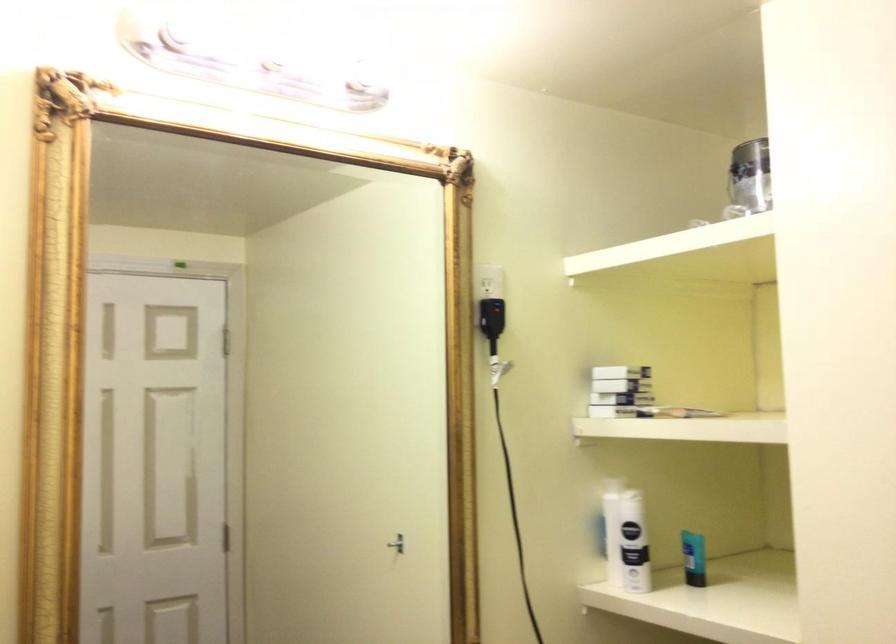
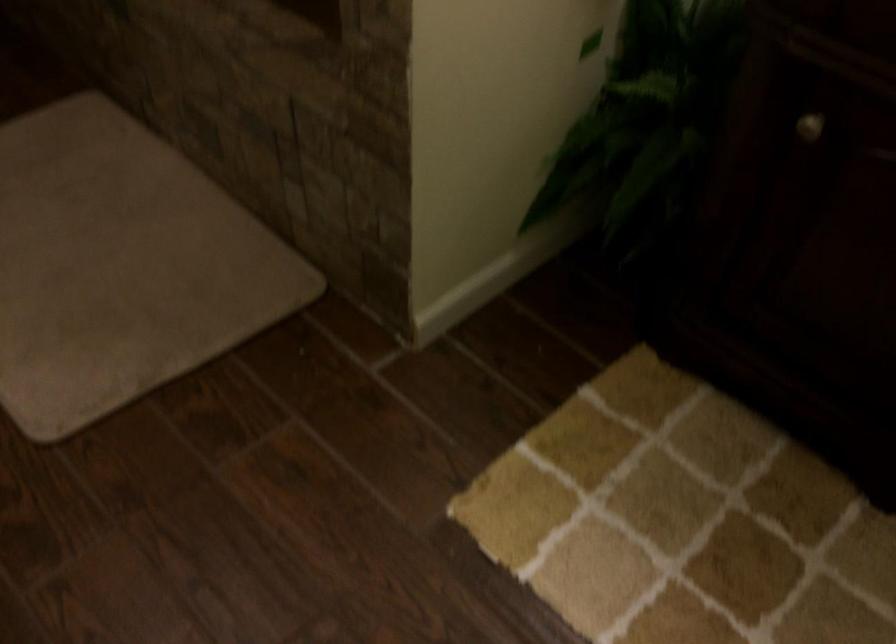
How did the camera likely rotate?

The rotation direction of the camera is left-down.